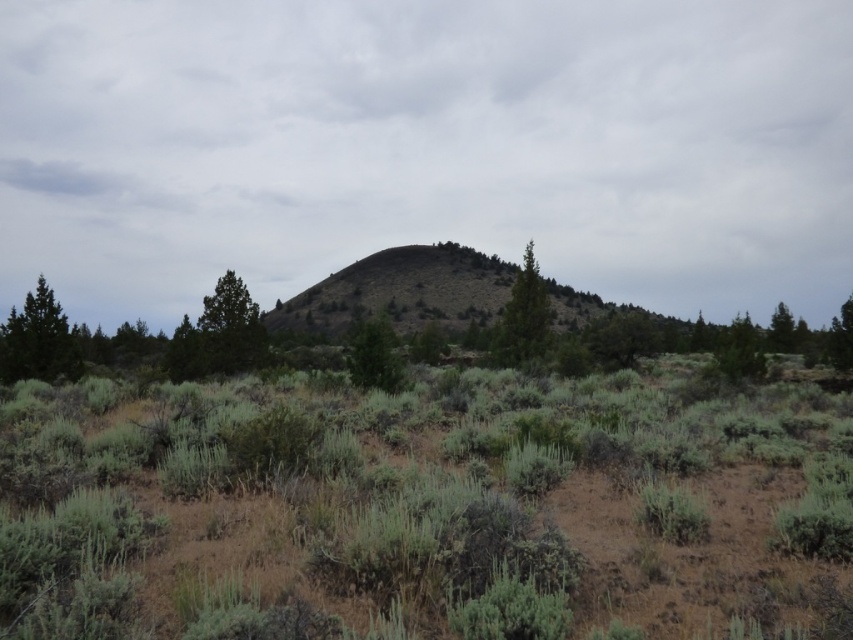
You are standing in the natural landscape and want to take a photo of the green matte tree at right and the green textured tree at right. Which tree will appear closer to the camera in the photo?

The green matte tree at right will appear closer to the camera in the photo because it is positioned in front of the green textured tree at right.

You are standing at the origin point of the coordinate system in the image. You want to walk towards the green grassy hill at center. What are the coordinates you should head towards?

You should head towards the coordinates point at (399, 292) to reach the green grassy hill at center.